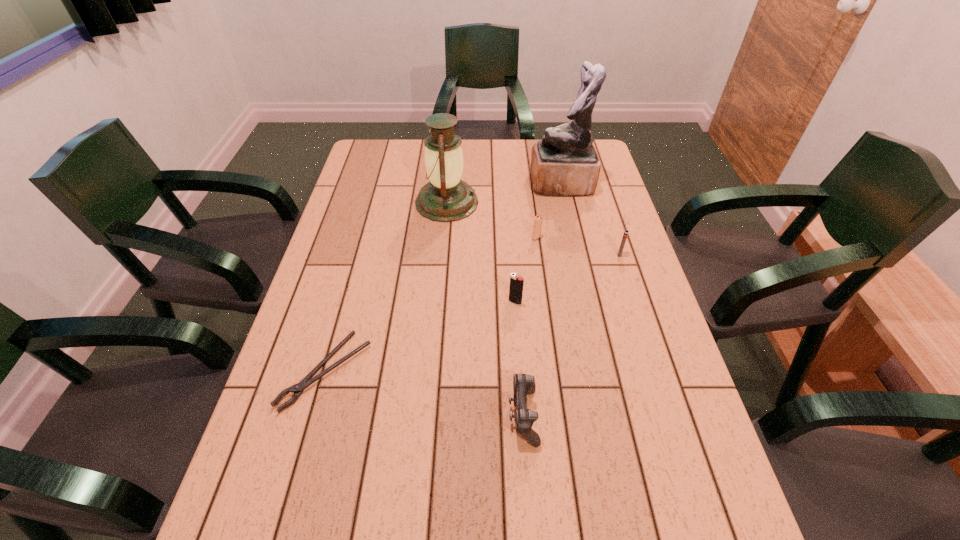
At what (x,y) coordinates should I click in order to perform the action: click on the tallest object. Please return your answer as a coordinate pair (x, y). This screenshot has height=540, width=960. Looking at the image, I should click on (564, 163).

Where is `lantern`? The height and width of the screenshot is (540, 960). lantern is located at coordinates (445, 198).

This screenshot has width=960, height=540. I want to click on the sixth object from right to left, so click(x=445, y=198).

Locate an element on the screen. the leftmost igniter is located at coordinates (516, 283).

The width and height of the screenshot is (960, 540). I want to click on the nearest igniter, so click(516, 283).

Locate an element on the screen. control is located at coordinates coord(523,384).

At what (x,y) coordinates should I click in order to perform the action: click on the second farthest igniter. Please return your answer as a coordinate pair (x, y). Looking at the image, I should click on (626, 232).

Locate an element on the screen. Image resolution: width=960 pixels, height=540 pixels. the rightmost object is located at coordinates (626, 232).

This screenshot has height=540, width=960. I want to click on the farthest igniter, so click(x=537, y=226).

Locate an element on the screen. the second igniter from left to right is located at coordinates (537, 226).